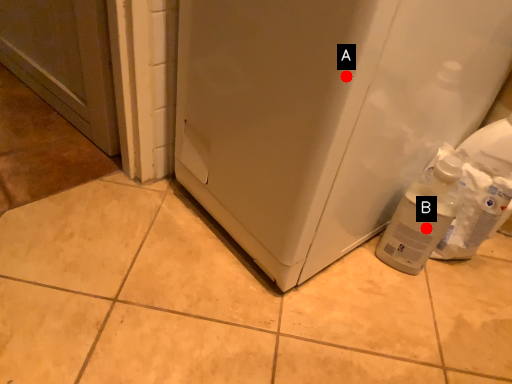
Question: Two points are circled on the image, labeled by A and B beside each circle. Which point appears farthest from the camera in this image?

Choices:
 (A) A is further
 (B) B is further

Answer: (B)